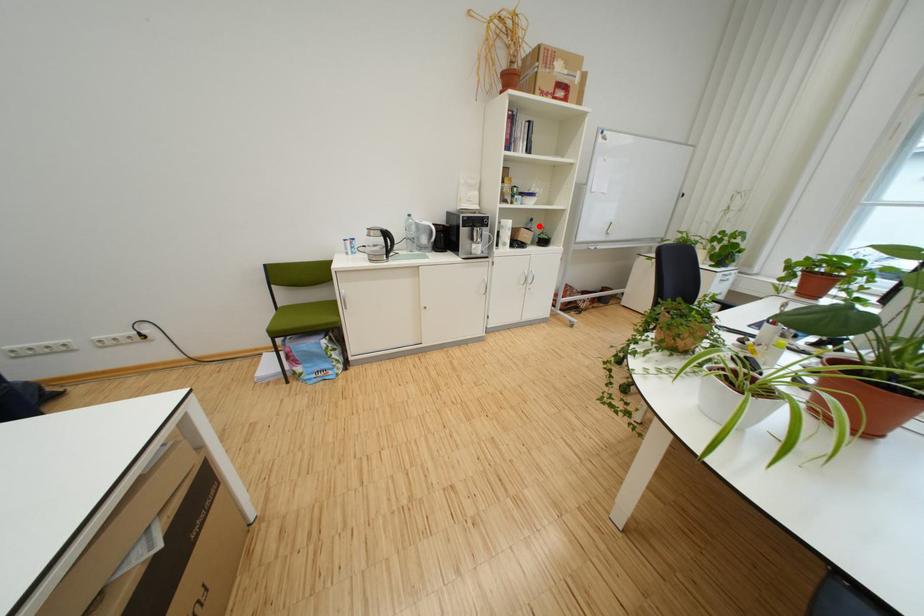
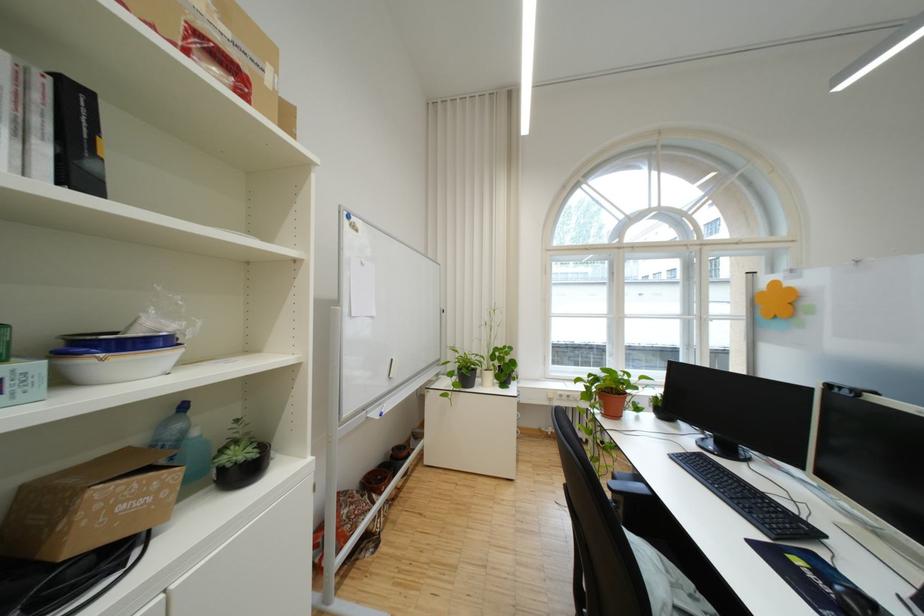
Question: I am providing you with two images of the same scene from different viewpoints. A red point is shown in image1. For the corresponding object point in image2, is it positioned nearer or farther from the camera?

Choices:
 (A) Nearer
 (B) Farther

Answer: (B)